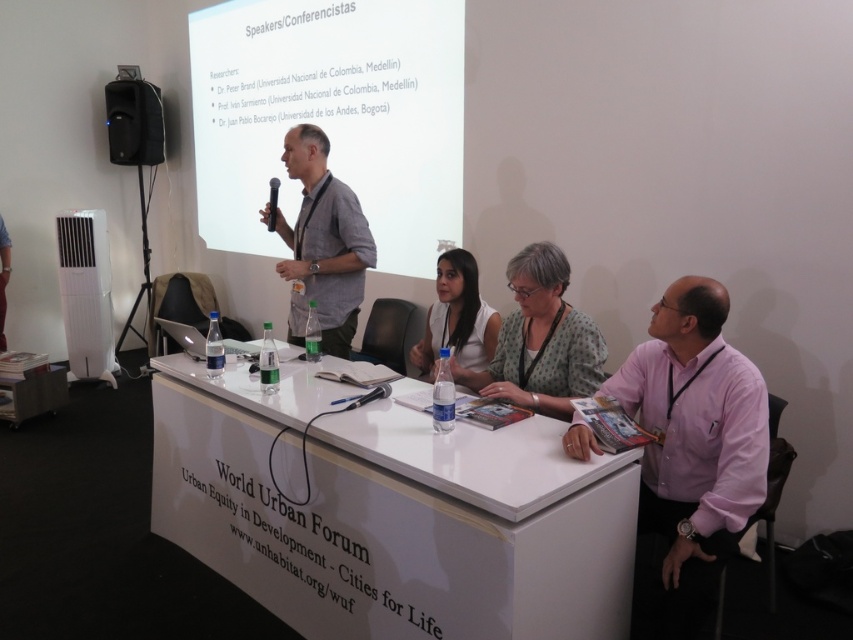
You are attending the World Urban Forum panel discussion and want to know if the speaker in the white matte shirt at center is shorter than the black matte speaker at upper left. Based on the image, can you confirm this?

The white matte shirt at center has a lesser height compared to black matte speaker at upper left, so yes, the speaker in the white matte shirt at center is indeed shorter than the black matte speaker at upper left.

You are standing in front of the panel discussion table at the World Urban Forum. There is a point marked at coordinates (468, 339). If you want to place a small plant exactly 10 feet away from this point, will you be able to do so without moving the table or any objects on it?

The distance between point (468, 339) and the viewer is 9.78 feet. Since the desired distance is 10 feet, placing the plant exactly 10 feet away would require moving 0.22 feet further back from your current position. However, since you cannot move the table or objects, you cannot adjust the distance. Therefore, you cannot place the plant exactly 10 feet away from the point without moving the table or objects.

You are attending the World Urban Forum panel discussion and notice two items on the table. One is a white matte shirt at center and the other is a black matte speaker at upper left. Which item is located to the right of the other?

The white matte shirt at center is positioned on the right side of black matte speaker at upper left.